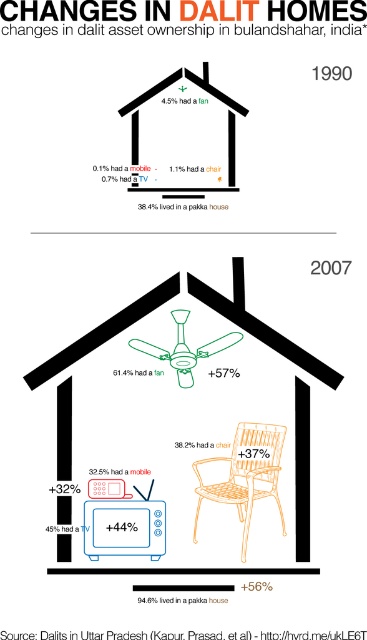
What do you see at coordinates (259, 323) in the screenshot? I see `blue plastic tv at lower left` at bounding box center [259, 323].

Who is more distant from viewer, (307,387) or (222,490)?

Positioned behind is point (307,387).

Who is more forward, (296,554) or (241,442)?

Positioned in front is point (296,554).

I want to click on blue plastic tv at lower left, so click(259, 323).

What do you see at coordinates (259, 323) in the screenshot?
I see `blue plastic tv at lower left` at bounding box center [259, 323].

At what (x,y) coordinates should I click in order to perform the action: click on blue plastic tv at lower left. Please return your answer as a coordinate pair (x, y). This screenshot has height=640, width=367. Looking at the image, I should click on (259, 323).

In order to click on blue plastic tv at lower left in this screenshot , I will do `click(259, 323)`.

Which of these two, orange woven chair at center or matte black tv at lower left, stands shorter?

With less height is matte black tv at lower left.

Looking at this image, who is lower down, orange woven chair at center or matte black tv at lower left?

orange woven chair at center is lower down.

Describe the element at coordinates (246, 472) in the screenshot. I see `orange woven chair at center` at that location.

At what (x,y) coordinates should I click in order to perform the action: click on orange woven chair at center. Please return your answer as a coordinate pair (x, y). This screenshot has width=367, height=640. Looking at the image, I should click on (246, 472).